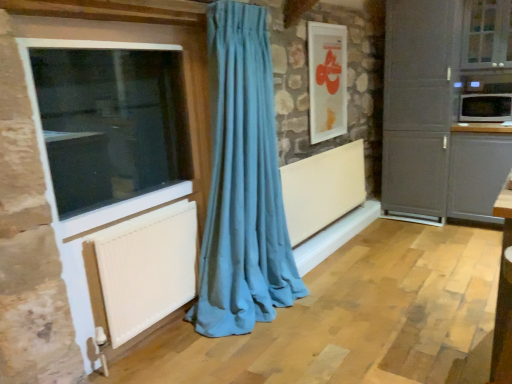
You are a GUI agent. You are given a task and a screenshot of the screen. Output one action in this format:
    pyautogui.click(x=<x>, y=<y>)
    Task: Click on the vacant region in front of matte gray cabinet at right, acting as the 1th cabinetry starting from the left
    
    Given the screenshot: What is the action you would take?
    pyautogui.click(x=435, y=235)